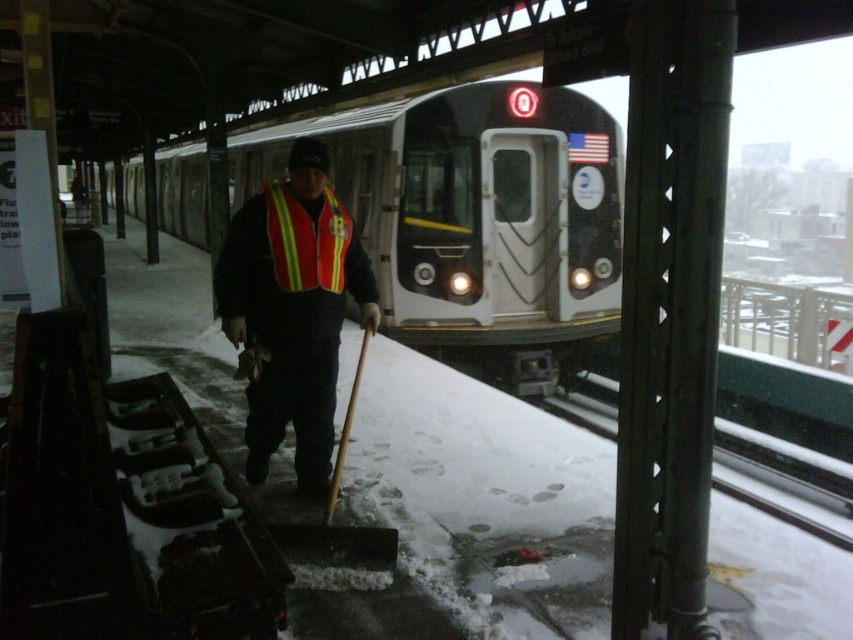
You are a passenger waiting on the platform and see both the reflective orange vest at center and the reflective fabric safety vest at center. Which one appears to have a larger width when viewed from your position?

The reflective orange vest at center might be wider than reflective fabric safety vest at center, so it appears to have a larger width when viewed from your position.

You are a passenger waiting on the subway platform and notice two reflective vests at the center of the platform. Which one is closer to you, the reflective orange vest at center or the reflective fabric safety vest at center?

The reflective orange vest at center is closer to you because it is positioned under the reflective fabric safety vest at center, meaning it is in front of the other vest.

You are standing at the subway station platform and want to board the matte black train at center. The platform is covered with snow. Where should you position yourself relative to the point marked at coordinates (x=476, y=220) to ensure you can safely reach the matte black train at center?

The point marked at coordinates (x=476, y=220) indicates the location of the matte black train at center. To board the train safely, you should position yourself directly at or near this point since it marks the train itself.